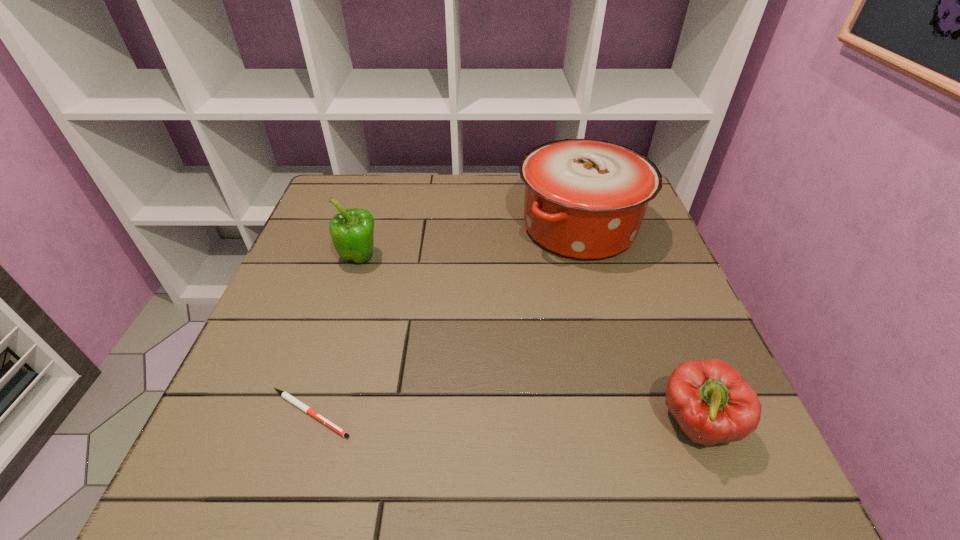
Find the location of `empty location between the casserole and the third tallest object`. empty location between the casserole and the third tallest object is located at coordinates (637, 326).

The height and width of the screenshot is (540, 960). What are the coordinates of `free space between the shorter bell pepper and the taller bell pepper` in the screenshot? It's located at (528, 341).

Image resolution: width=960 pixels, height=540 pixels. I want to click on vacant region between the second tallest object and the nearer bell pepper, so click(x=528, y=341).

What are the coordinates of `vacant space in between the right bell pepper and the farther bell pepper` in the screenshot? It's located at (528, 341).

Identify the location of the second closest object to the right bell pepper. The image size is (960, 540). (285, 395).

You are a GUI agent. You are given a task and a screenshot of the screen. Output one action in this format:
    pyautogui.click(x=<x>, y=<y>)
    Task: Click on the object that stands as the closest to the farther bell pepper
    The height and width of the screenshot is (540, 960).
    Given the screenshot: What is the action you would take?
    pyautogui.click(x=285, y=395)

Identify the location of vacant space that satisfies the following two spatial constraints: 1. on the front side of the third tallest object; 2. on the left side of the tallest object. This screenshot has width=960, height=540. (633, 424).

At what (x,y) coordinates should I click in order to perform the action: click on vacant region that satisfies the following two spatial constraints: 1. on the front side of the casserole; 2. on the clicker of the shortest object. Please return your answer as a coordinate pair (x, y). This screenshot has width=960, height=540. Looking at the image, I should click on (630, 413).

This screenshot has width=960, height=540. What are the coordinates of `vacant region that satisfies the following two spatial constraints: 1. on the clicker of the pen; 2. on the left side of the third tallest object` in the screenshot? It's located at (307, 424).

Find the location of a particular element. The image size is (960, 540). blank area in the image that satisfies the following two spatial constraints: 1. on the back side of the farther bell pepper; 2. on the right side of the casserole is located at coordinates (369, 227).